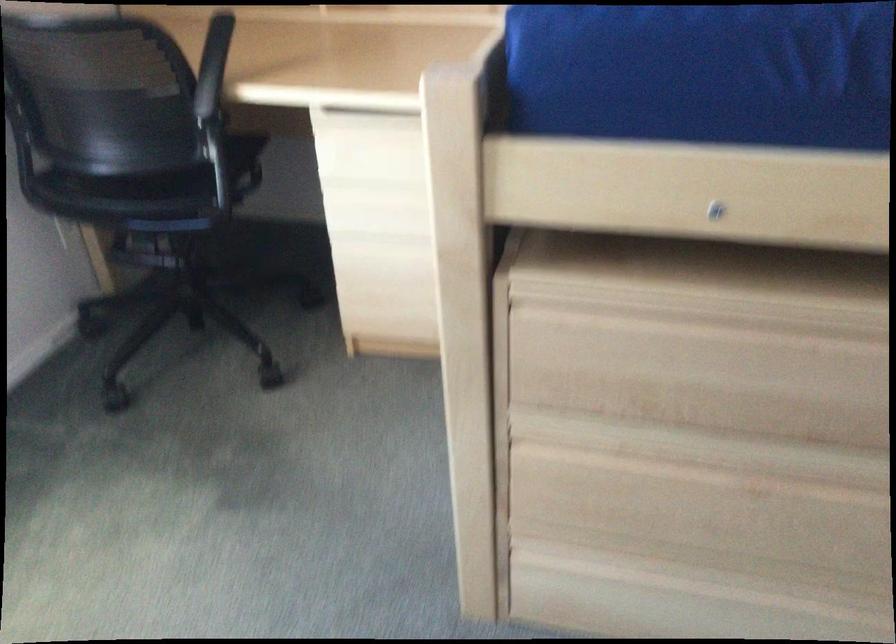
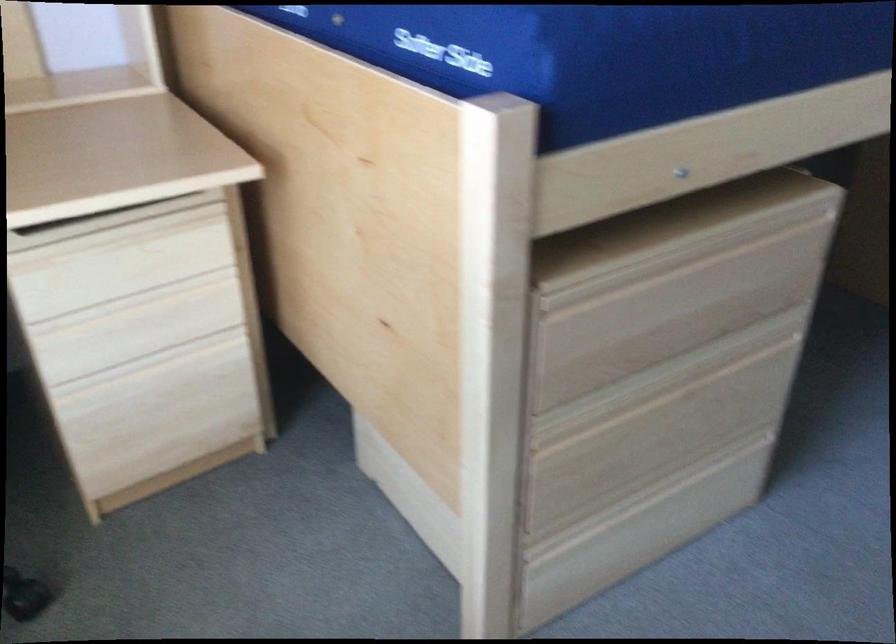
The point at (733, 292) is marked in the first image. Where is the corresponding point in the second image?

(668, 240)